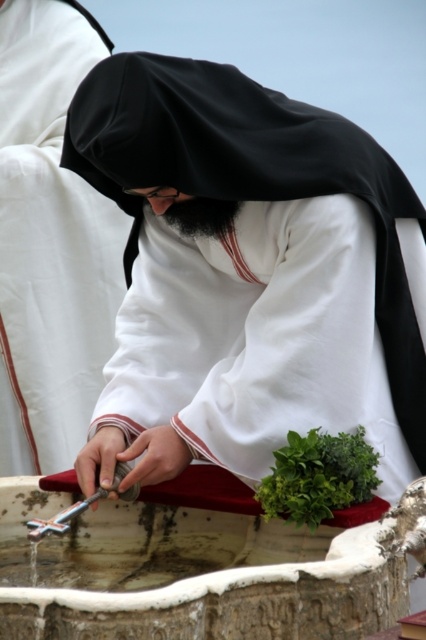
Question: Can you confirm if white matte cloth at center is positioned above green leafy at center?

Choices:
 (A) yes
 (B) no

Answer: (A)

Question: Which of the following is the closest to the observer?

Choices:
 (A) white matte cloth at center
 (B) green leafy at center

Answer: (B)

Question: Can you confirm if white matte cloth at center is positioned below green leafy at center?

Choices:
 (A) yes
 (B) no

Answer: (B)

Question: Is white matte cloth at center behind green leafy at center?

Choices:
 (A) no
 (B) yes

Answer: (B)

Question: Which of the following is the closest to the observer?

Choices:
 (A) white matte cloth at center
 (B) green leafy at center

Answer: (B)